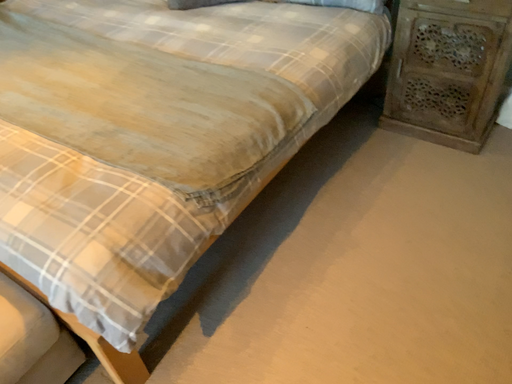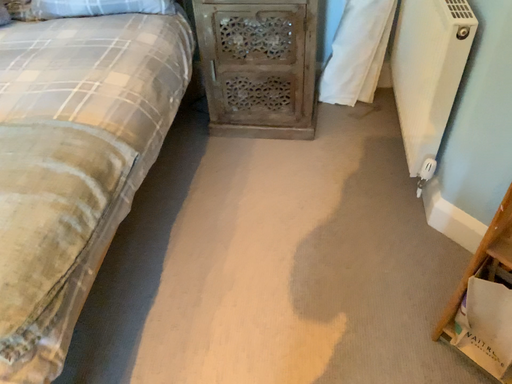
Question: How did the camera likely rotate when shooting the video?

Choices:
 (A) rotated left
 (B) rotated right

Answer: (B)